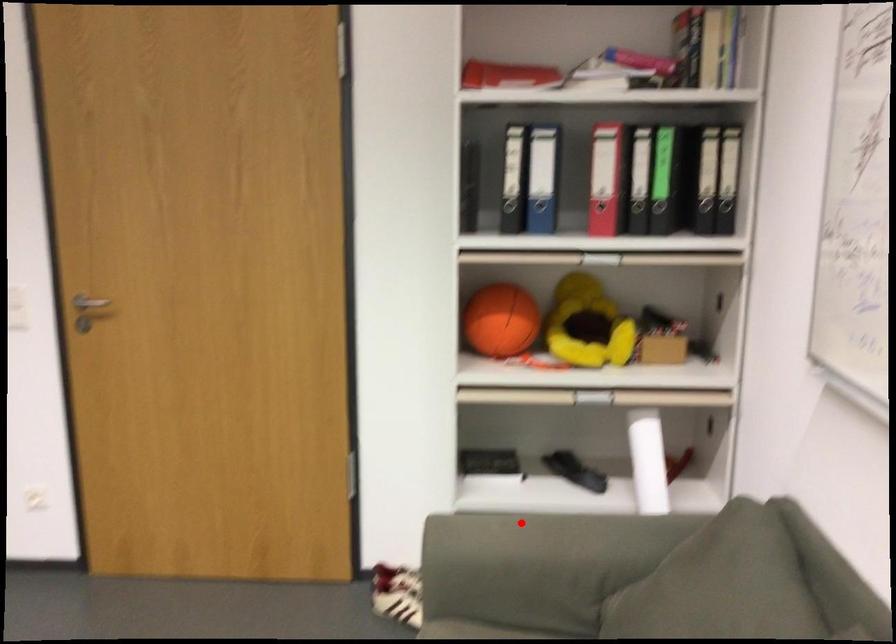
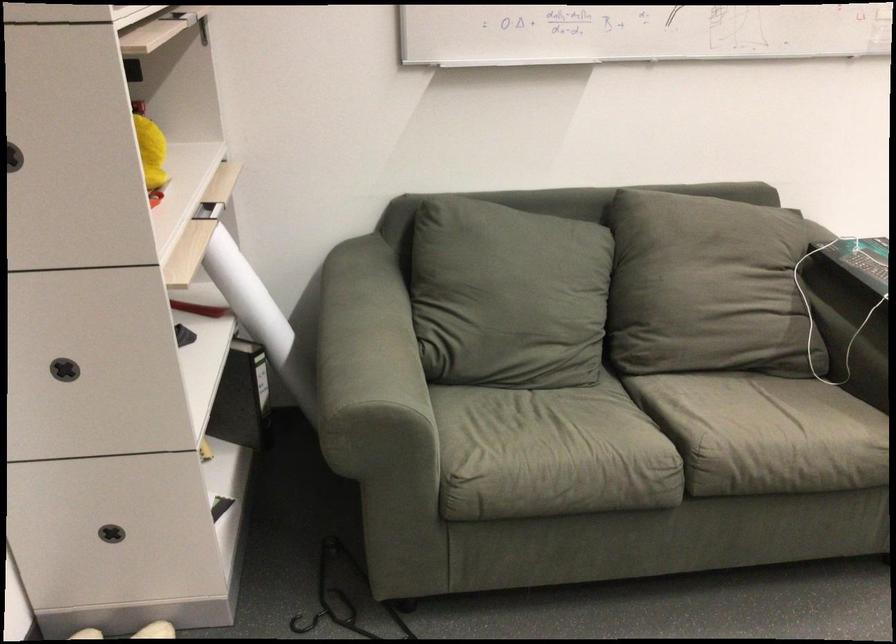
Locate, in the second image, the point that corresponds to the highlighted location in the first image.

(358, 342)